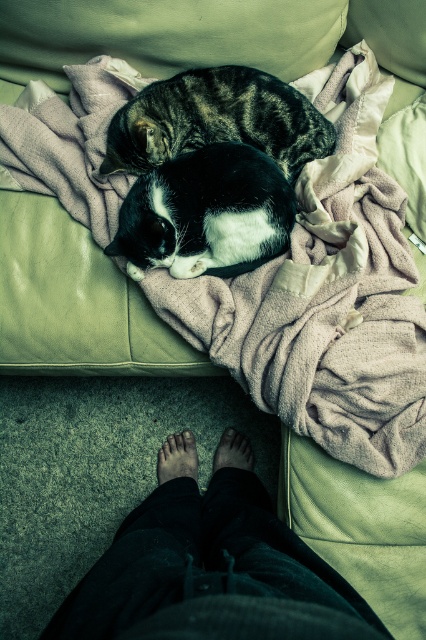
Question: Which is nearer to the black and white fur cat at center?

Choices:
 (A) brown matte foot at lower center
 (B) dark blue jeans at lower center
 (C) striped fur cat at upper center
 (D) smooth skin foot at lower center

Answer: (C)

Question: Based on their relative distances, which object is farther from the smooth skin foot at lower center?

Choices:
 (A) dark blue jeans at lower center
 (B) striped fur cat at upper center
 (C) black and white fur cat at center
 (D) brown matte foot at lower center

Answer: (B)

Question: Can you confirm if striped fur cat at upper center is bigger than smooth skin foot at lower center?

Choices:
 (A) yes
 (B) no

Answer: (A)

Question: Is dark blue jeans at lower center positioned behind black and white fur cat at center?

Choices:
 (A) yes
 (B) no

Answer: (B)

Question: Does black and white fur cat at center come in front of striped fur cat at upper center?

Choices:
 (A) no
 (B) yes

Answer: (B)

Question: Which object is closer to the camera taking this photo?

Choices:
 (A) dark blue jeans at lower center
 (B) brown matte foot at lower center
 (C) striped fur cat at upper center
 (D) smooth skin foot at lower center

Answer: (A)